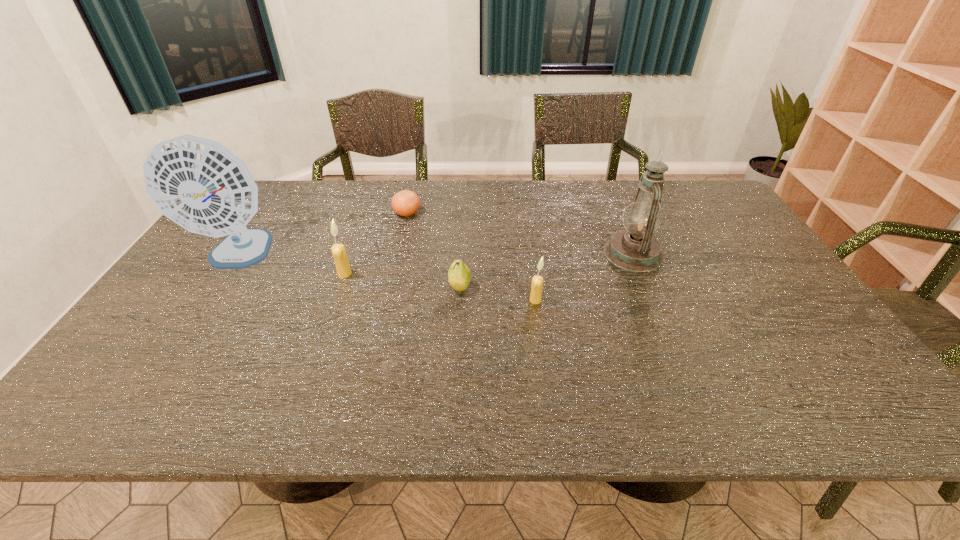
The width and height of the screenshot is (960, 540). I want to click on vacant region located 0.160m on the back of the farther candle, so click(358, 236).

This screenshot has height=540, width=960. What are the coordinates of `vacant region located on the left of the shorter candle` in the screenshot? It's located at (380, 300).

Where is `free space located 0.240m on the back of the oil lamp`? This screenshot has width=960, height=540. free space located 0.240m on the back of the oil lamp is located at coordinates (609, 197).

Find the location of a particular element. free spot located on the right of the pear is located at coordinates (587, 288).

This screenshot has width=960, height=540. I want to click on free space located 0.250m on the left of the farthest object, so coord(318,213).

Image resolution: width=960 pixels, height=540 pixels. I want to click on free location located on the grille of the leftmost object, so pyautogui.click(x=165, y=367).

Image resolution: width=960 pixels, height=540 pixels. In order to click on object at the far edge in this screenshot , I will do `click(405, 203)`.

Find the location of `object at the left edge`. object at the left edge is located at coordinates (197, 183).

I want to click on vacant space at the far edge, so click(x=479, y=201).

This screenshot has width=960, height=540. What are the coordinates of `vacant space at the near edge` in the screenshot? It's located at (584, 348).